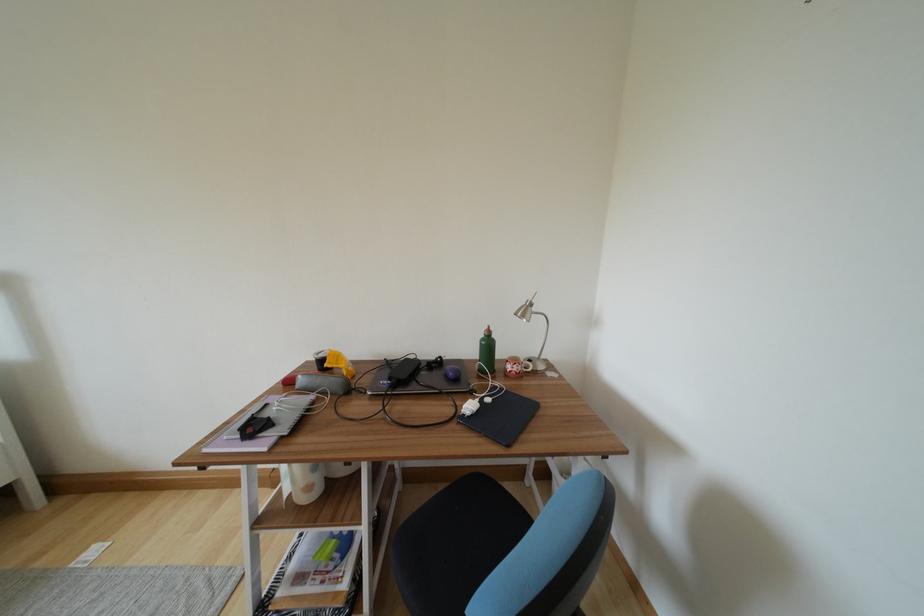
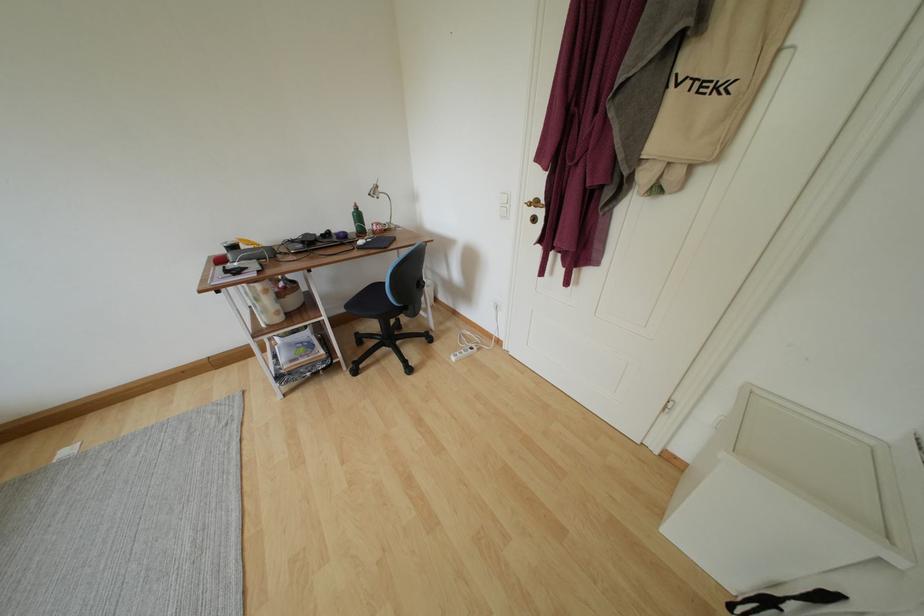
In the second image, find the point that corresponds to [448,376] in the first image.

(339, 241)